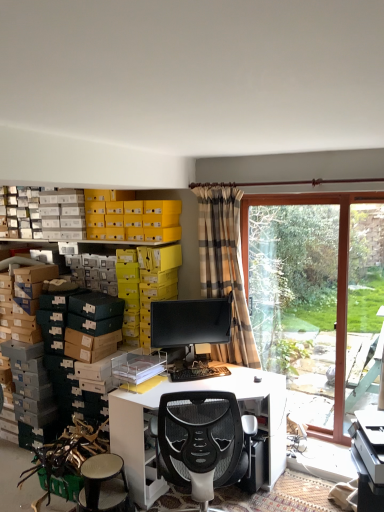
Question: Does matte black monitor at center appear on the right side of white glossy desk at center?

Choices:
 (A) yes
 (B) no

Answer: (B)

Question: Can you confirm if matte black monitor at center is smaller than white glossy desk at center?

Choices:
 (A) no
 (B) yes

Answer: (B)

Question: Is matte black monitor at center not inside white glossy desk at center?

Choices:
 (A) yes
 (B) no

Answer: (A)

Question: From the image's perspective, would you say matte black monitor at center is positioned over white glossy desk at center?

Choices:
 (A) no
 (B) yes

Answer: (B)

Question: From the image's perspective, is matte black monitor at center below white glossy desk at center?

Choices:
 (A) no
 (B) yes

Answer: (A)

Question: Based on their sizes in the image, would you say black plastic keyboard at center is bigger or smaller than white textured stool at lower left?

Choices:
 (A) small
 (B) big

Answer: (A)

Question: Visually, is black plastic keyboard at center positioned to the left or to the right of white textured stool at lower left?

Choices:
 (A) left
 (B) right

Answer: (B)

Question: Choose the correct answer: Is black plastic keyboard at center inside white textured stool at lower left or outside it?

Choices:
 (A) inside
 (B) outside

Answer: (B)

Question: Considering the positions of black plastic keyboard at center and white textured stool at lower left in the image, is black plastic keyboard at center wider or thinner than white textured stool at lower left?

Choices:
 (A) wide
 (B) thin

Answer: (B)

Question: Is white textured stool at lower left inside the boundaries of plaid fabric curtain at center, or outside?

Choices:
 (A) inside
 (B) outside

Answer: (B)

Question: Does point (99, 470) appear closer or farther from the camera than point (226, 247)?

Choices:
 (A) farther
 (B) closer

Answer: (B)

Question: Relative to plaid fabric curtain at center, is white textured stool at lower left in front or behind?

Choices:
 (A) front
 (B) behind

Answer: (A)

Question: Based on their sizes in the image, would you say white textured stool at lower left is bigger or smaller than plaid fabric curtain at center?

Choices:
 (A) small
 (B) big

Answer: (A)

Question: Is transparent glass window at right in front of or behind matte black monitor at center in the image?

Choices:
 (A) behind
 (B) front

Answer: (B)

Question: Looking at their shapes, would you say transparent glass window at right is wider or thinner than matte black monitor at center?

Choices:
 (A) thin
 (B) wide

Answer: (B)